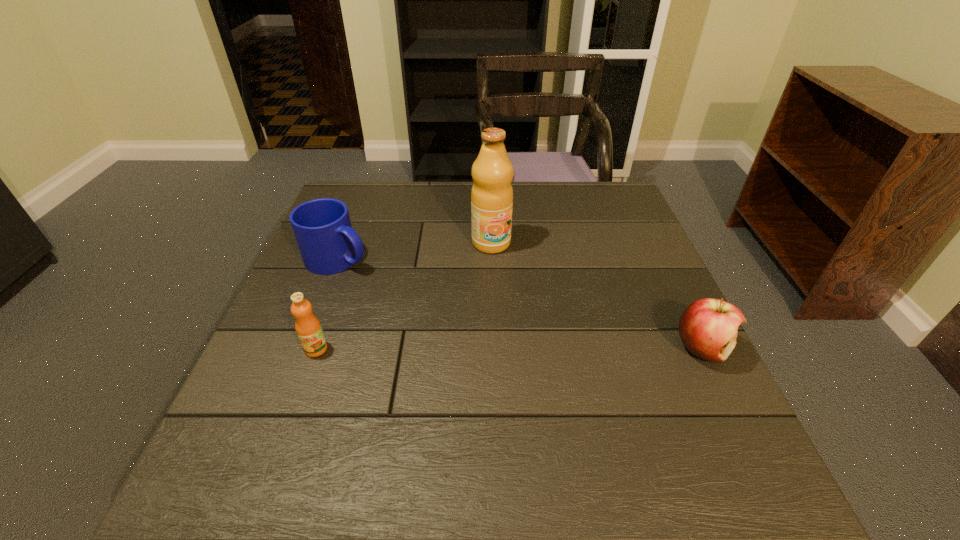
Locate an element on the screen. orange juice is located at coordinates (308, 328).

Image resolution: width=960 pixels, height=540 pixels. Identify the location of the rightmost object. (708, 327).

This screenshot has height=540, width=960. Identify the location of the second object from right to left. (492, 194).

Identify the location of the tallest object. The height and width of the screenshot is (540, 960). (492, 194).

What are the coordinates of `mug` in the screenshot? It's located at (328, 244).

This screenshot has height=540, width=960. What are the coordinates of `free space located 0.110m on the front label of the orange juice` in the screenshot? It's located at (296, 404).

I want to click on vacant space located on the bitten side of the rightmost object, so click(x=738, y=421).

Find the location of a particular element. vacant point located on the front label of the tallest object is located at coordinates click(x=522, y=290).

I want to click on vacant region located 0.400m on the front label of the tallest object, so click(574, 369).

Locate an element on the screen. vacant space located on the front label of the tallest object is located at coordinates (509, 270).